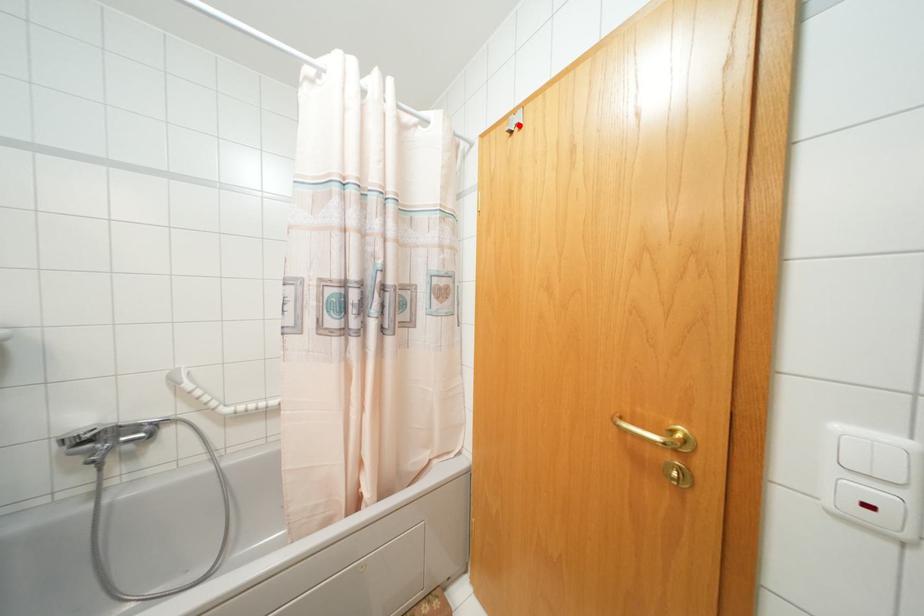
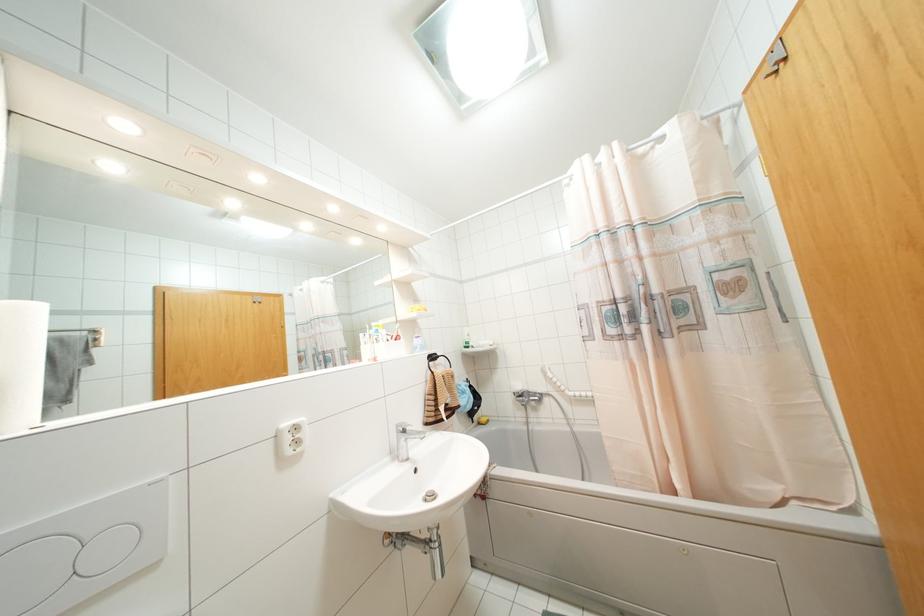
Where in the second image is the point corresponding to the highlighted location from the first image?

(784, 58)